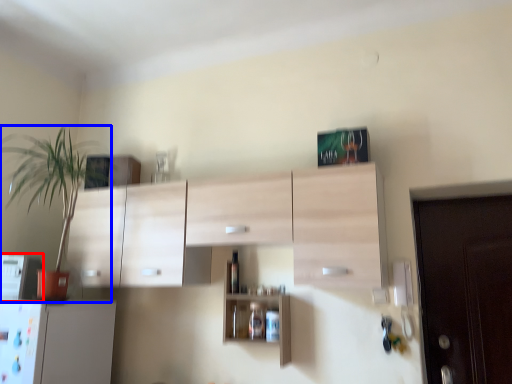
Question: Which object is closer to the camera taking this photo, appliance (highlighted by a red box) or houseplant (highlighted by a blue box)?

Choices:
 (A) appliance
 (B) houseplant

Answer: (B)